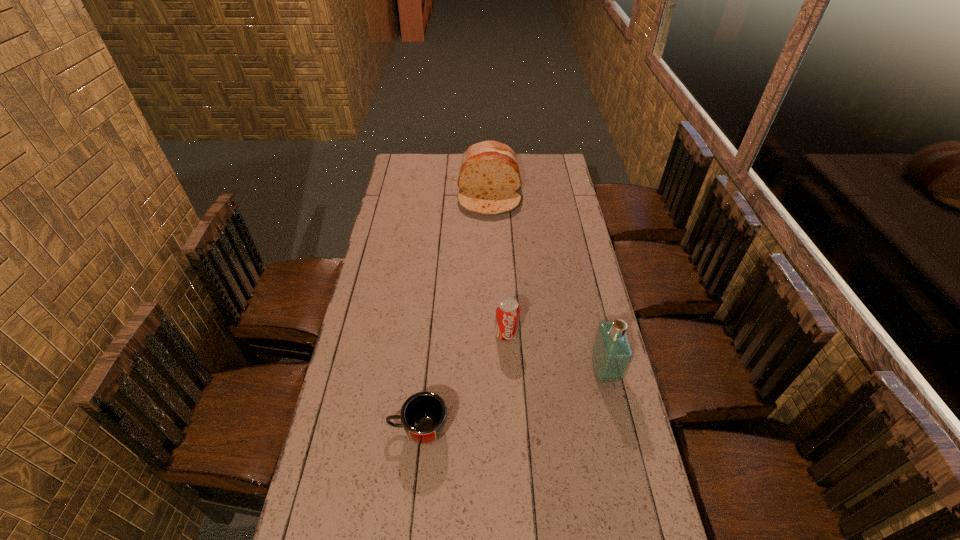
Locate an element on the screen. The height and width of the screenshot is (540, 960). free area in between the nearest object and the third shortest object is located at coordinates (454, 311).

Locate an element on the screen. The image size is (960, 540). empty location between the third shortest object and the tallest object is located at coordinates (547, 282).

I want to click on the closest object to the nearest object, so click(507, 310).

Identify which object is located as the nearest to the perfume. Please provide its 2D coordinates. Your answer should be formatted as a tuple, i.e. [(x, y)], where the tuple contains the x and y coordinates of a point satisfying the conditions above.

[(507, 310)]

Identify the location of free location that satisfies the following two spatial constraints: 1. on the front side of the third farthest object; 2. on the front label of the third nearest object. The height and width of the screenshot is (540, 960). (509, 371).

Identify the location of free space that satisfies the following two spatial constraints: 1. on the front side of the second shortest object; 2. on the front label of the rightmost object. (509, 371).

Where is `free spot that satisfies the following two spatial constraints: 1. on the front side of the third farthest object; 2. on the front label of the third nearest object`? The height and width of the screenshot is (540, 960). free spot that satisfies the following two spatial constraints: 1. on the front side of the third farthest object; 2. on the front label of the third nearest object is located at coordinates (509, 371).

Image resolution: width=960 pixels, height=540 pixels. I want to click on vacant area that satisfies the following two spatial constraints: 1. on the front side of the bread; 2. on the front label of the tallest object, so click(x=493, y=371).

The width and height of the screenshot is (960, 540). I want to click on free location that satisfies the following two spatial constraints: 1. on the front side of the bread; 2. on the front label of the perfume, so click(x=493, y=371).

I want to click on free location that satisfies the following two spatial constraints: 1. on the front side of the tallest object; 2. on the front label of the farthest object, so pyautogui.click(x=493, y=371).